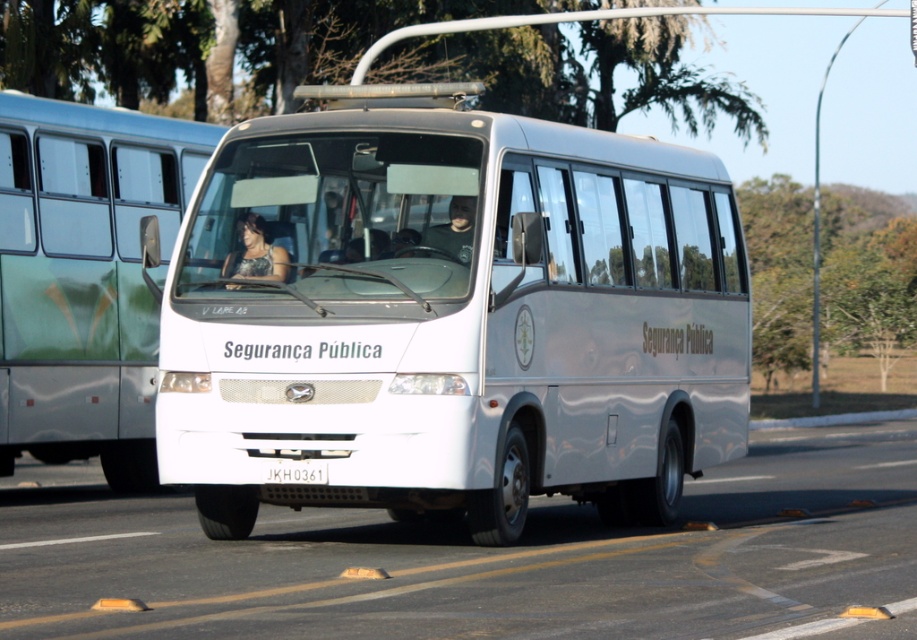
You are a pedestrian standing at the side of the road. You see a white metallic bus at center and a matte black jacket at center. Which object is higher up in the image?

The white metallic bus at center is higher up in the image than the matte black jacket at center.

You are at a fashion show and see two items displayed at the center stage. The sparkly silver dress at center and the matte black jacket at center. Which item takes up more space on the stage?

The sparkly silver dress at center is larger in size than the matte black jacket at center, so it takes up more space on the stage.